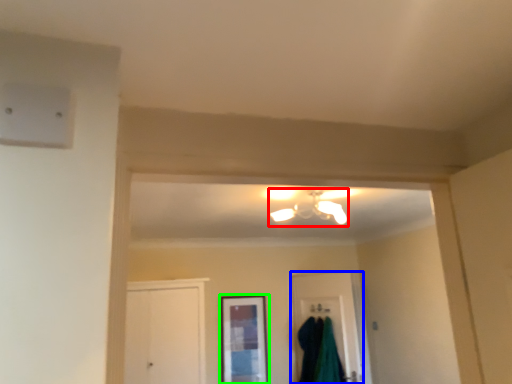
Question: Considering the real-world distances, which object is farthest from light fixture (highlighted by a red box)? door (highlighted by a blue box) or window (highlighted by a green box)?

Choices:
 (A) door
 (B) window

Answer: (B)